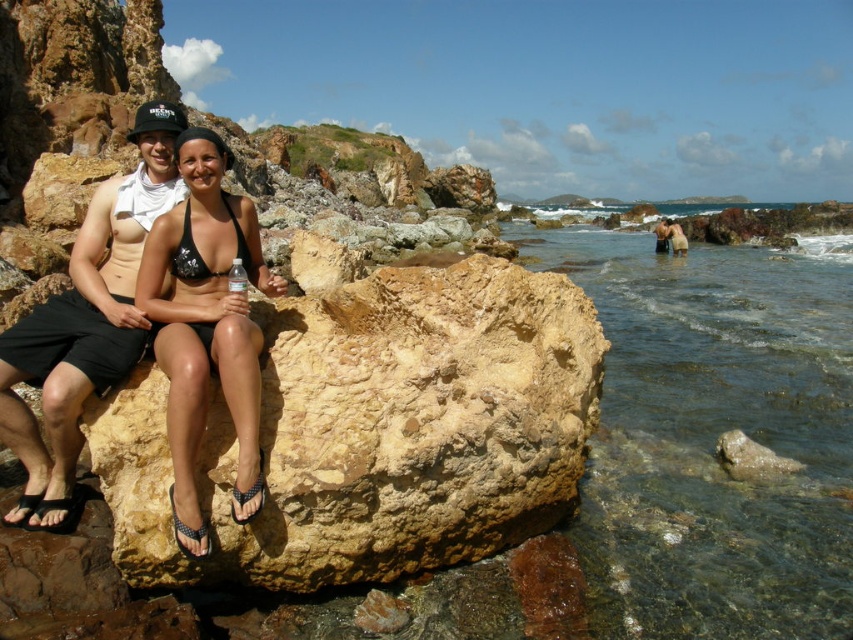
Is black matte bikini top at center to the right of matte black bikini at lower right from the viewer's perspective?

In fact, black matte bikini top at center is to the left of matte black bikini at lower right.

Does point (189, 259) lie behind point (676, 225)?

No, it is not.

Identify the location of black matte bikini top at center. (190, 256).

At what (x,y) coordinates should I click in order to perform the action: click on black matte bikini top at center. Please return your answer as a coordinate pair (x, y). The height and width of the screenshot is (640, 853). Looking at the image, I should click on [x=190, y=256].

Which is below, clear water at lower right or matte black bikini at lower right?

clear water at lower right

Can you confirm if clear water at lower right is taller than matte black bikini at lower right?

Incorrect, clear water at lower right's height is not larger of matte black bikini at lower right's.

Locate an element on the screen. This screenshot has height=640, width=853. clear water at lower right is located at coordinates (714, 436).

Between point (173, 484) and point (679, 230), which one is positioned behind?

The point (679, 230) is more distant.

Which is above, black bikini at center or matte black bikini at lower right?

matte black bikini at lower right

I want to click on black bikini at center, so click(x=206, y=326).

Identify the location of black bikini at center. (206, 326).